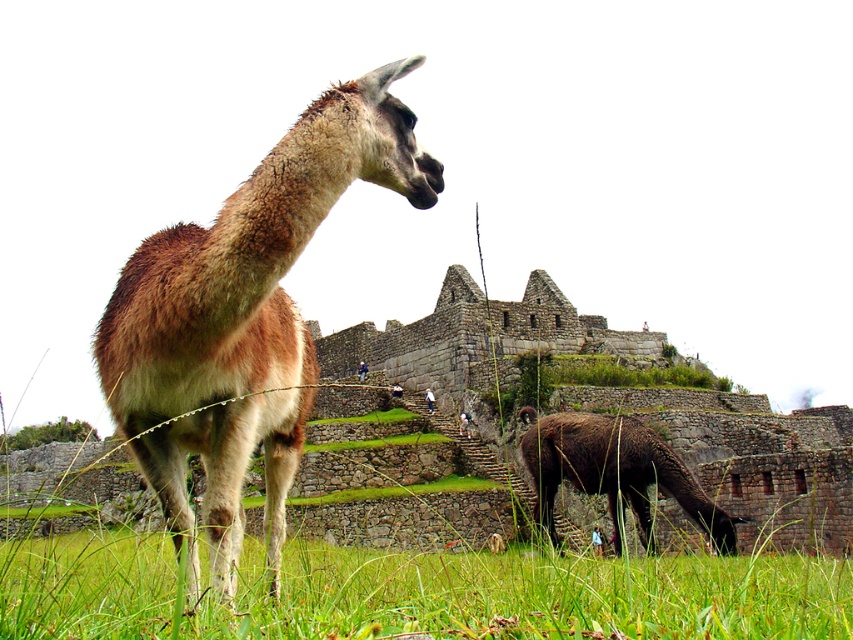
Between point (257, 401) and point (592, 433), which one is positioned in front?

Point (257, 401)

Is brown woolen alpaca at center further to the viewer compared to brown woolen camel at lower right?

No, brown woolen alpaca at center is in front of brown woolen camel at lower right.

Between point (241, 237) and point (637, 515), which one is positioned behind?

The point (637, 515) is more distant.

Find the location of a particular element. Image resolution: width=853 pixels, height=640 pixels. brown woolen alpaca at center is located at coordinates (244, 320).